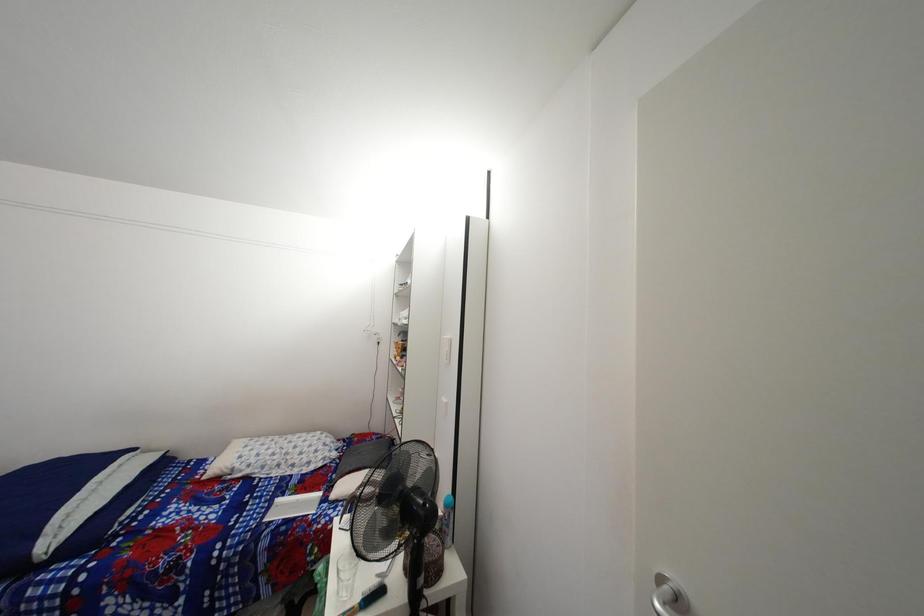
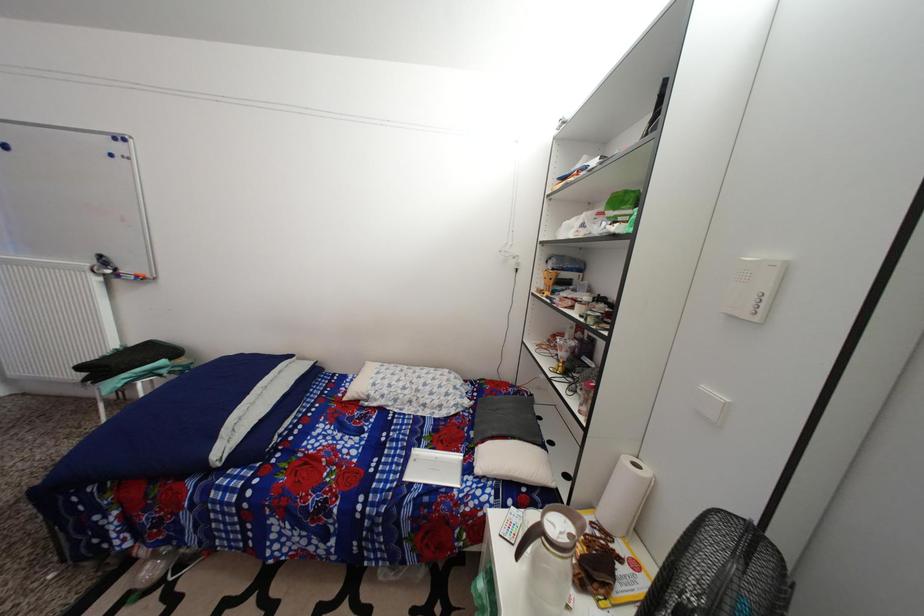
From the picture: Which direction would the cameraman need to move to produce the second image?

The cameraman moved toward left, forward.